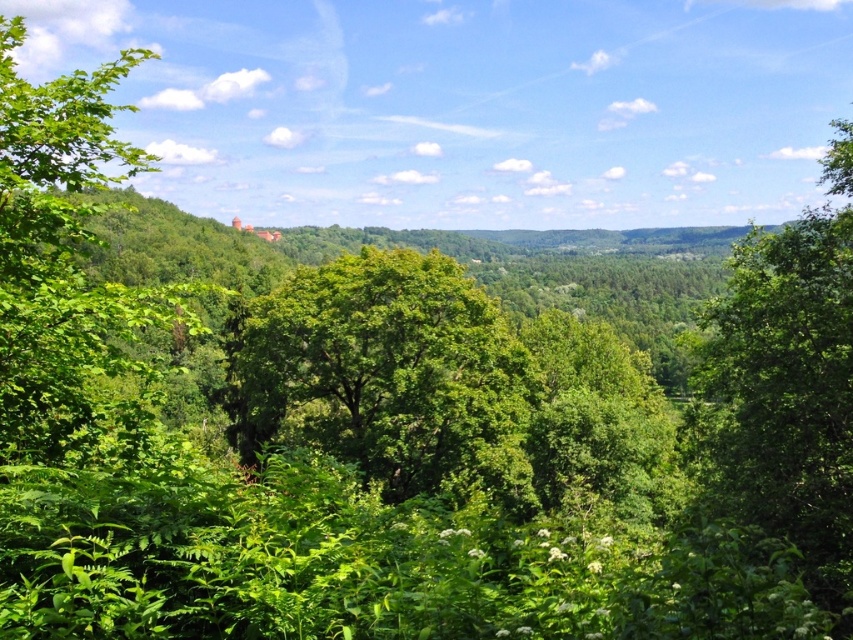
You are a photographer standing at the camera position. You want to take a closeup photo of the green leafy tree at center. Do you need to move closer or farther away to get a better closeup?

The green leafy tree at center is 28.28 meters away from the camera. To take a closeup photo, you need to move closer to the tree to reduce the distance between the camera and the tree.

You are standing in the lush landscape and want to take a photo of the green leafy tree at left. If your camera has a maximum focus range of 18 feet, will it be able to capture the tree clearly?

The green leafy tree at left is 17.95 feet away from the camera, which is within the maximum focus range of 18 feet. Therefore, the camera can capture the tree clearly.